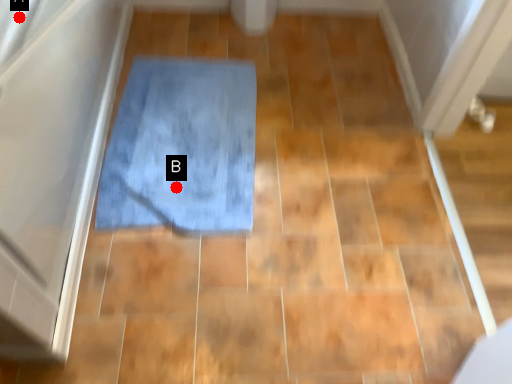
Question: Two points are circled on the image, labeled by A and B beside each circle. Which point is farther from the camera taking this photo?

Choices:
 (A) A is further
 (B) B is further

Answer: (B)